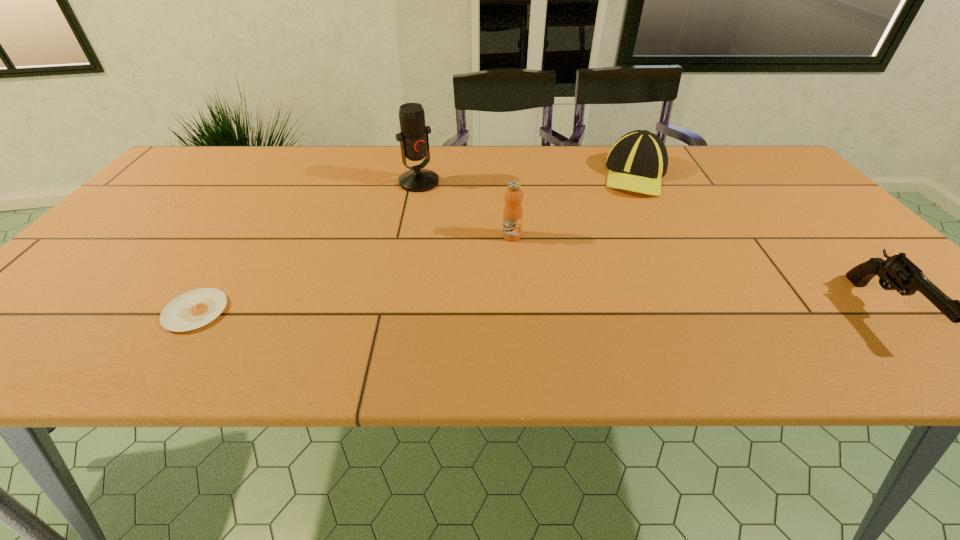
Where is `vacant space on the desktop that is between the egg yolk and the rightmost object and is positioned on the front label of the fourth shortest object`? Image resolution: width=960 pixels, height=540 pixels. vacant space on the desktop that is between the egg yolk and the rightmost object and is positioned on the front label of the fourth shortest object is located at coordinates (521, 311).

Locate an element on the screen. This screenshot has height=540, width=960. free space on the desktop that is between the leftmost object and the gun and is positioned on the side of the tallest object with the red ring is located at coordinates point(554,311).

This screenshot has height=540, width=960. I want to click on free spot on the desktop that is between the shortest object and the gun and is positioned with the brim of the baseball cap facing forward, so click(550, 311).